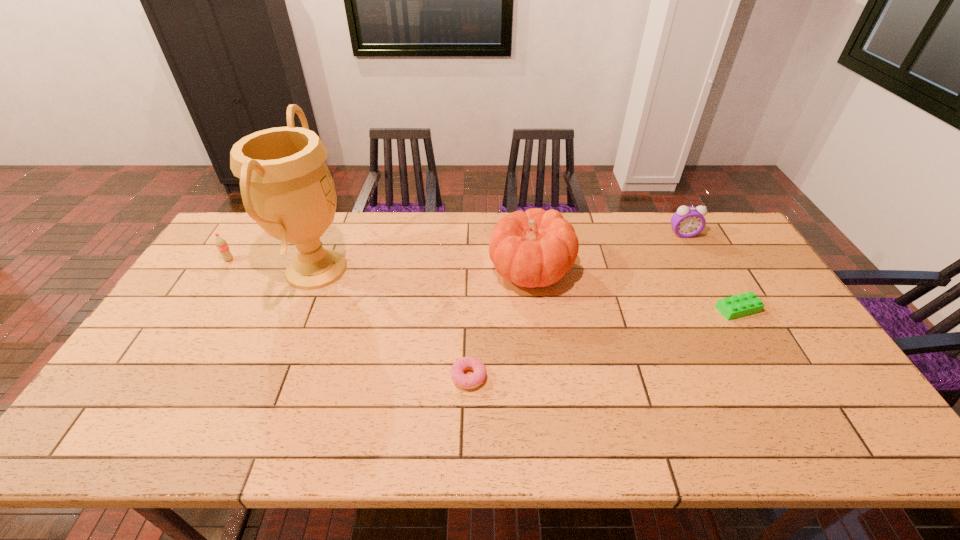
The width and height of the screenshot is (960, 540). I want to click on Lego located in the right edge section of the desktop, so click(x=737, y=306).

I want to click on object that is at the far right corner, so click(687, 222).

What are the coordinates of `free space at the far edge of the desktop` in the screenshot? It's located at (660, 245).

This screenshot has height=540, width=960. I want to click on vacant position at the near edge of the desktop, so click(787, 419).

Image resolution: width=960 pixels, height=540 pixels. Identify the location of free space at the left edge of the desktop. (200, 346).

In the image, there is a desktop. Where is `free space at the right edge`? The width and height of the screenshot is (960, 540). free space at the right edge is located at coordinates (760, 336).

Where is `vacant space at the far left corner of the desktop`? vacant space at the far left corner of the desktop is located at coordinates (245, 240).

The image size is (960, 540). I want to click on vacant space at the far right corner, so click(731, 240).

The image size is (960, 540). In order to click on vacant space in between the Lego and the shortest object in this screenshot , I will do `click(603, 343)`.

Identify the location of blank region between the pumpkin and the shortest object. The image size is (960, 540). (499, 323).